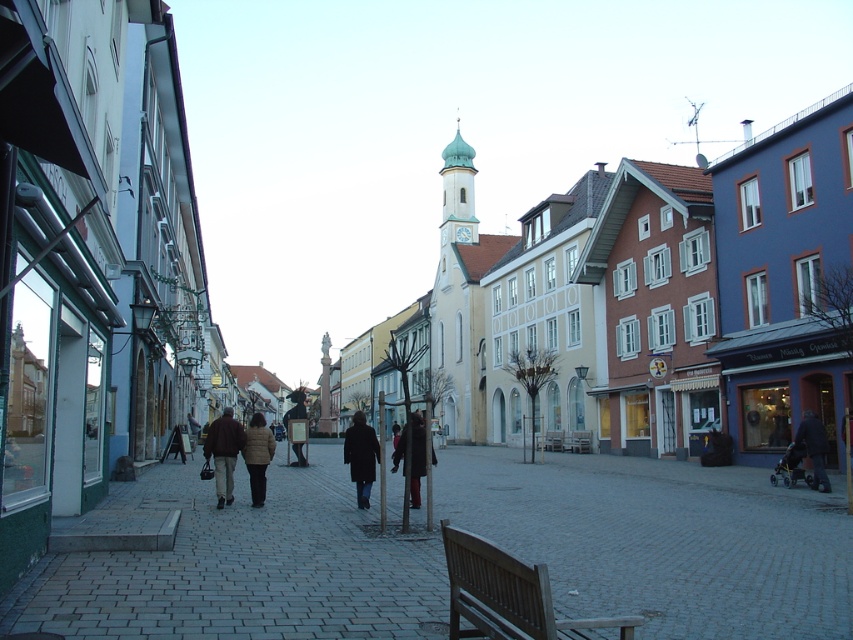
Question: Which object is the closest to the brown wooden bench at lower center?

Choices:
 (A) dark brown coat at center
 (B) wooden bench at center

Answer: (A)

Question: Does gray cobblestone pavement at center have a lesser width compared to dark brown leather jacket at center?

Choices:
 (A) no
 (B) yes

Answer: (A)

Question: Based on their relative distances, which object is nearer to the brown wooden bench at lower center?

Choices:
 (A) dark brown leather jacket at center
 (B) dark brown coat at center

Answer: (B)

Question: Does dark brown coat at center have a smaller size compared to wooden bench at center?

Choices:
 (A) yes
 (B) no

Answer: (B)

Question: Does brown wooden bench at lower center appear on the left side of dark brown leather coat at center?

Choices:
 (A) yes
 (B) no

Answer: (B)

Question: Which object is the closest to the dark brown coat at center?

Choices:
 (A) brown wooden bench at lower center
 (B) gray cobblestone pavement at center

Answer: (B)